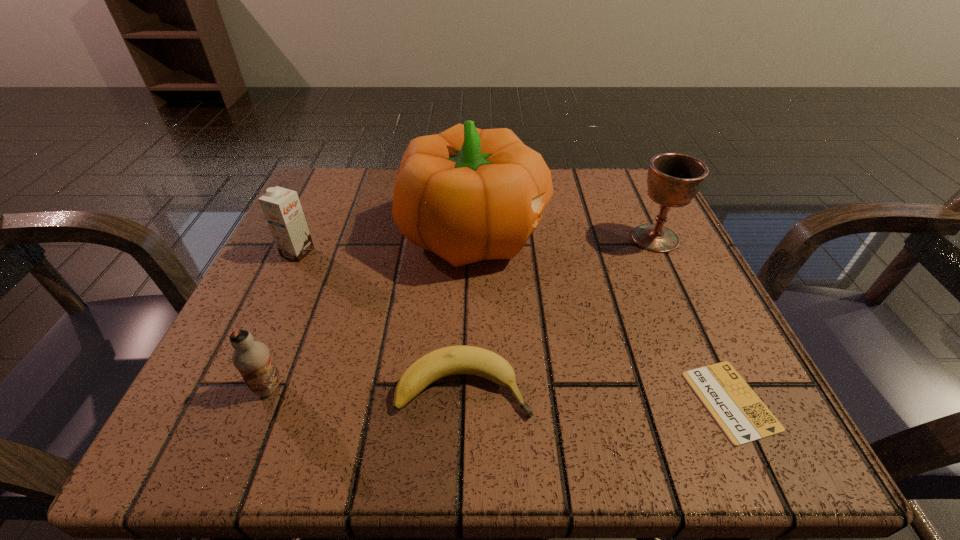
Locate an element on the screen. This screenshot has width=960, height=540. object at the far right corner is located at coordinates (673, 180).

Where is `object that is at the near right corner`? The image size is (960, 540). object that is at the near right corner is located at coordinates (743, 417).

In the image, there is a desktop. At what (x,y) coordinates should I click in order to perform the action: click on vacant space at the far edge. Please return your answer as a coordinate pair (x, y). Image resolution: width=960 pixels, height=540 pixels. Looking at the image, I should click on 563,210.

At what (x,y) coordinates should I click in order to perform the action: click on vacant space at the near edge. Please return your answer as a coordinate pair (x, y). Looking at the image, I should click on (483, 437).

The width and height of the screenshot is (960, 540). Identify the location of vacant space at the left edge of the desktop. (265, 274).

Identify the location of vacant space at the far left corner of the desktop. (341, 184).

The image size is (960, 540). I want to click on vacant space at the near left corner of the desktop, so click(x=224, y=429).

In the image, there is a desktop. Where is `vacant space at the far right corner`? The image size is (960, 540). vacant space at the far right corner is located at coordinates (637, 168).

Where is `vacant space at the near right corner`? The width and height of the screenshot is (960, 540). vacant space at the near right corner is located at coordinates (777, 416).

Find the location of a particular element. Image resolution: width=960 pixels, height=540 pixels. free spot between the tallest object and the nearer chocolate milk is located at coordinates (372, 310).